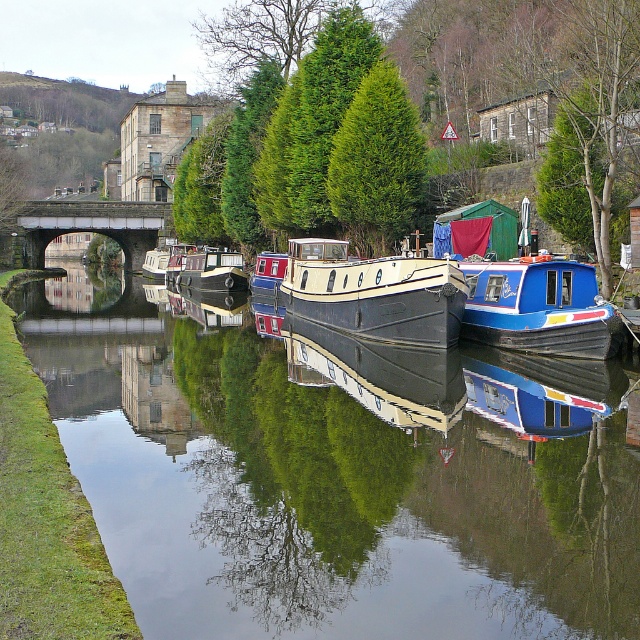
You are a photographer planning to take a reflection shot of the blue glossy boat at right and the smooth water at center. Based on the scene, will the reflection of the boat be visible on the water?

Yes, the reflection of the blue glossy boat at right will be visible on the smooth water at center because the smooth water at center is located below the boat, creating a clear reflective surface.

You are standing at the point marked by the coordinates point [374,292] in the canal scene. Looking around, you see the matte black barge at center. Which direction should you face to see the grassy embankment on the left side of the canal?

Since you are at the point indicating the matte black barge at center, facing towards the grassy embankment on the left side of the canal would mean turning to your left. The grassy embankment is located on the left side of the canal, so facing that direction from the barge would align you with it.

You are standing on the grassy embankment on the left side of the canal. You want to take a photo of the blue glossy boat at right but need to ensure you can see the entire boat in the frame. Considering the smooth water at center, will the boat be fully visible in your photo?

The smooth water at center is closer to the viewer than the blue glossy boat at right, so the boat may be partially obscured by the water in the foreground. Adjust your position or angle to ensure the boat is fully visible.